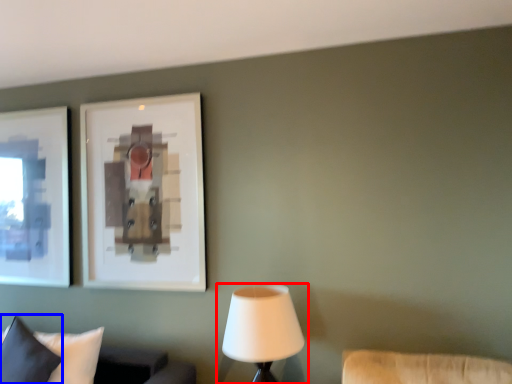
Question: Among these objects, which one is nearest to the camera, lamp (highlighted by a red box) or pillow (highlighted by a blue box)?

Choices:
 (A) lamp
 (B) pillow

Answer: (A)